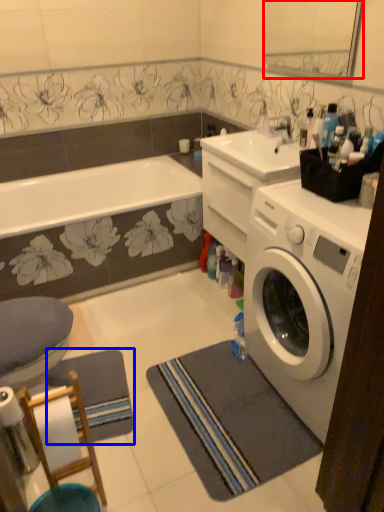
Question: Which of the following is the farthest to the observer, mirror (highlighted by a red box) or yoga mat (highlighted by a blue box)?

Choices:
 (A) mirror
 (B) yoga mat

Answer: (A)